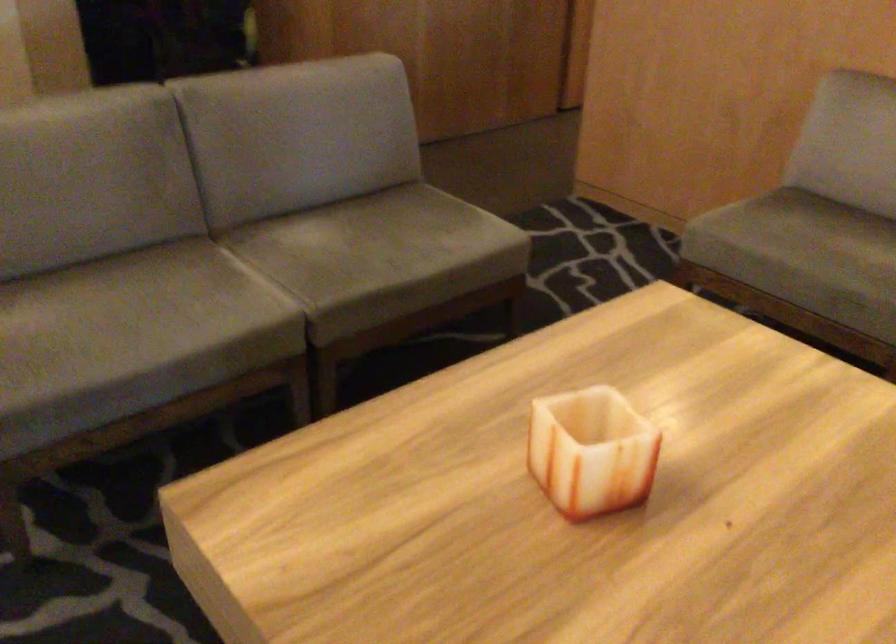
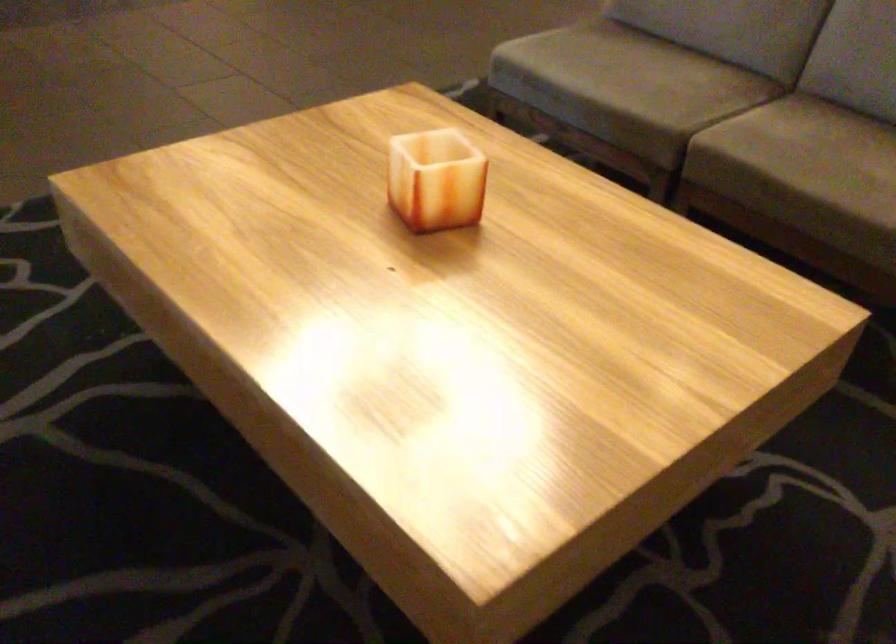
The point at (389, 259) is marked in the first image. Where is the corresponding point in the second image?

(800, 161)